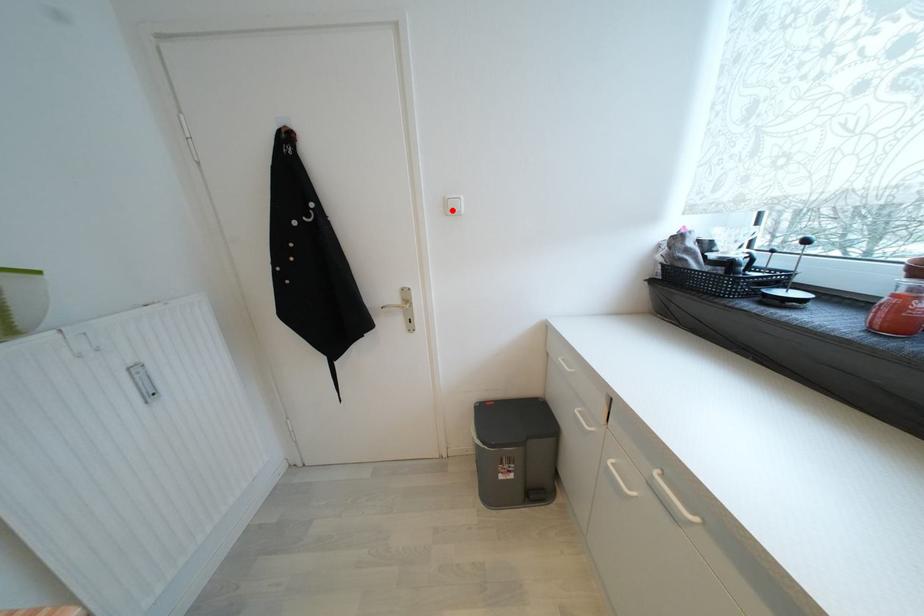
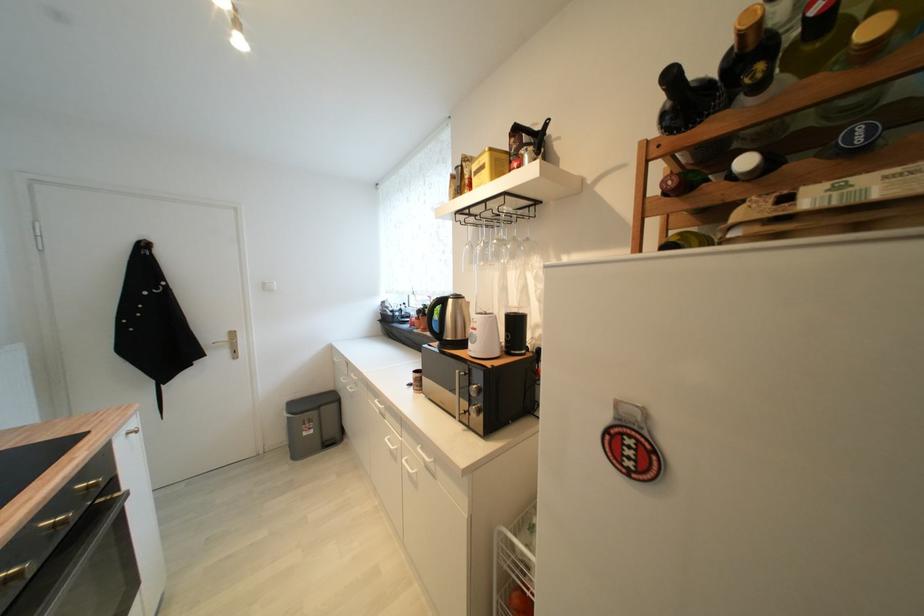
Find the pixel in the second image that matches the highlighted location in the first image.

(271, 289)